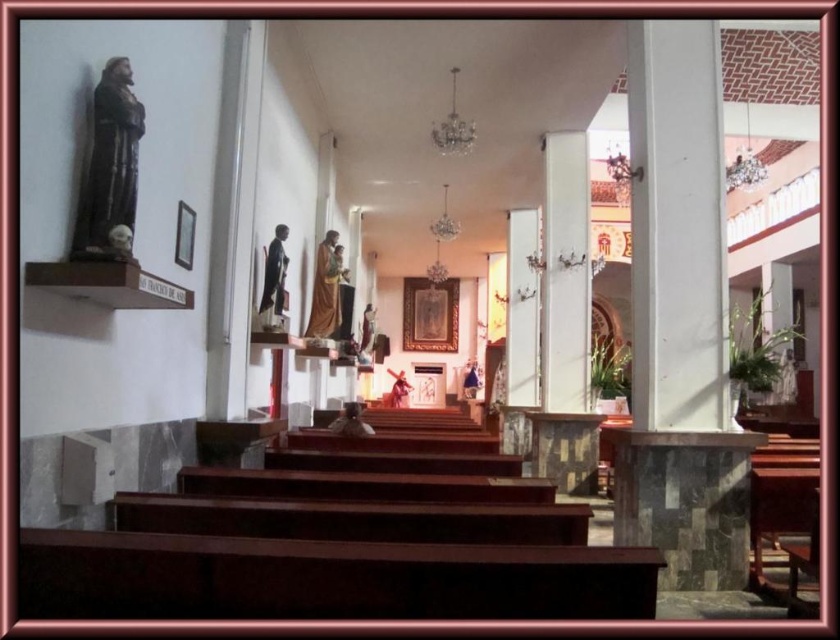
You are an interior designer planning to place a new decorative item in the church. The item requires a base that can support its weight, and you have two options in the scene. Which object between the white marble pillar at right and the matte brown statue at left would be more suitable as a stable base for the new item?

The white marble pillar at right is larger in size than the matte brown statue at left, making it a more stable base for the new decorative item.

You are an event planner setting up a stage in the church. You need to place a 6 meter long table between the matte brown statue at left and the wooden statue at center. Will the table fit between them?

The distance between the matte brown statue at left and the wooden statue at center is 5.87 meters. Since the table is 6 meters long, it will not fit as the space is slightly shorter than the table.